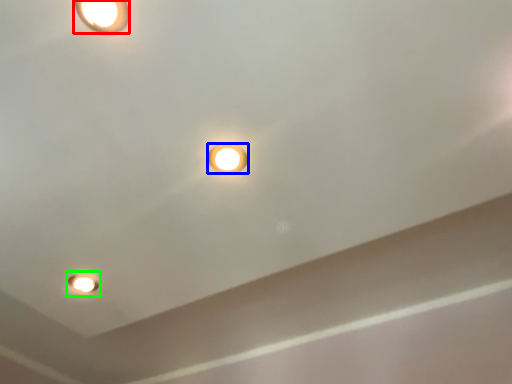
Question: Estimate the real-world distances between objects in this image. Which object is closer to lamp (highlighted by a red box), lamp (highlighted by a blue box) or light fixture (highlighted by a green box)?

Choices:
 (A) lamp
 (B) light fixture

Answer: (A)